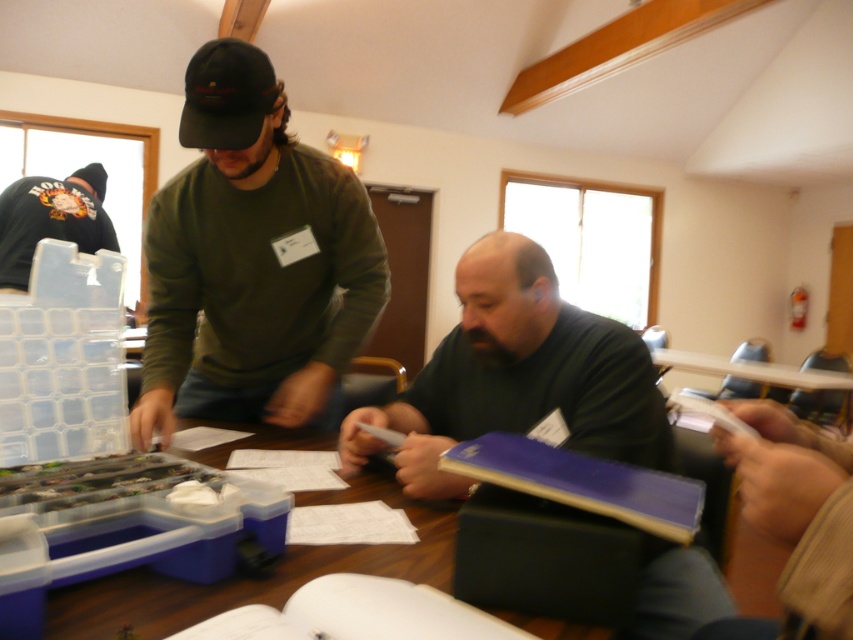
Question: Which of the following is the farthest from the observer?

Choices:
 (A) green matte sweater at upper left
 (B) wooden table at center
 (C) dark green sweater at center
 (D) black fabric baseball cap at upper center

Answer: (D)

Question: Estimate the real-world distances between objects in this image. Which object is farther from the dark green hoodie at upper left?

Choices:
 (A) black fabric baseball cap at upper center
 (B) dark green sweater at center
 (C) green matte sweater at upper left

Answer: (B)

Question: Is dark green sweater at center to the left of wooden table at center from the viewer's perspective?

Choices:
 (A) no
 (B) yes

Answer: (A)

Question: Is green matte sweater at upper left wider than black fabric baseball cap at upper center?

Choices:
 (A) yes
 (B) no

Answer: (A)

Question: Is the position of dark green sweater at center more distant than that of dark green hoodie at upper left?

Choices:
 (A) yes
 (B) no

Answer: (B)

Question: Estimate the real-world distances between objects in this image. Which object is farther from the green matte sweater at upper left?

Choices:
 (A) black fabric baseball cap at upper center
 (B) dark green sweater at center
 (C) wooden table at center
 (D) dark green hoodie at upper left

Answer: (D)